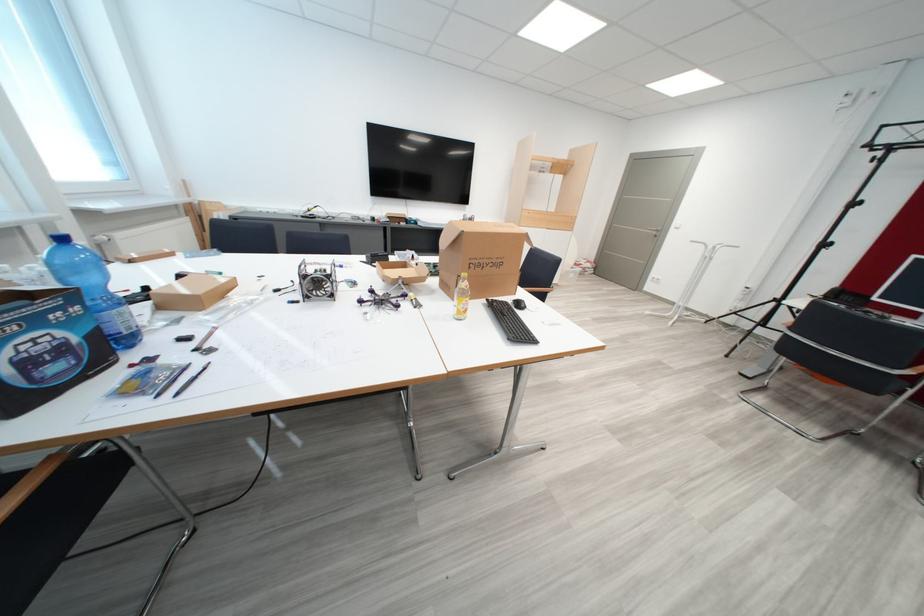
This screenshot has width=924, height=616. Describe the element at coordinates (480, 257) in the screenshot. I see `a large cardboard box` at that location.